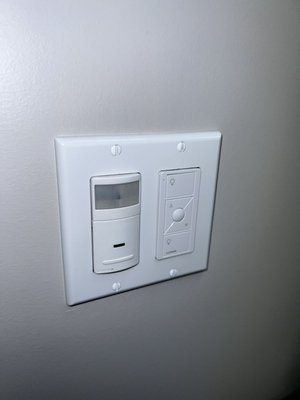
This screenshot has width=300, height=400. Identify the location of top left screw. (116, 155).